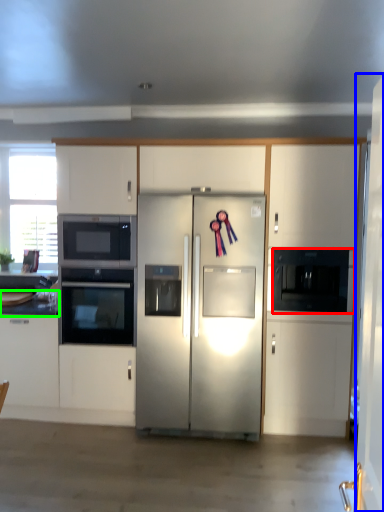
Question: Based on their relative distances, which object is nearer to microwave oven (highlighted by a red box)? Choose from door (highlighted by a blue box) and countertop (highlighted by a green box).

Choices:
 (A) door
 (B) countertop

Answer: (A)